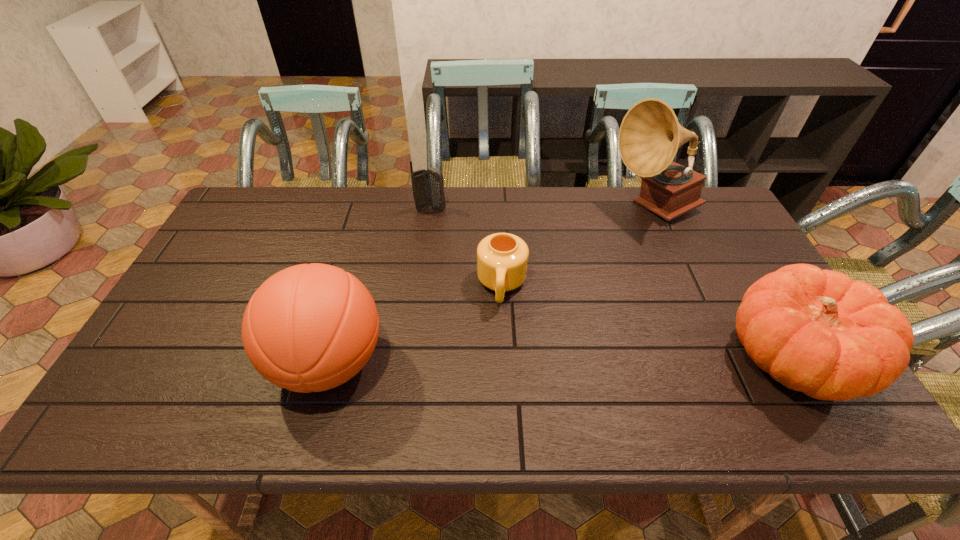
Locate an element on the screen. The height and width of the screenshot is (540, 960). free region at the far left corner is located at coordinates (265, 208).

This screenshot has width=960, height=540. Identify the location of free space between the third object from right to left and the phonograph record. (578, 247).

Locate an element on the screen. vacant point located between the fourth object from right to left and the pumpkin is located at coordinates (611, 284).

You are a GUI agent. You are given a task and a screenshot of the screen. Output one action in this format:
    pyautogui.click(x=<x>, y=<y>)
    Task: Click on the free spot between the cellular telephone and the tallest object
    
    Given the screenshot: What is the action you would take?
    pyautogui.click(x=542, y=209)

Where is `free space between the tallest object and the mug`? The image size is (960, 540). free space between the tallest object and the mug is located at coordinates (578, 247).

The width and height of the screenshot is (960, 540). I want to click on unoccupied position between the fourth object from right to left and the phonograph record, so click(542, 209).

This screenshot has width=960, height=540. Identify the location of vacant area between the shortest object and the cellular telephone. (467, 247).

Find the location of a particular element. The image size is (960, 540). vacant point located between the pumpkin and the second object from left to right is located at coordinates (611, 284).

You are a GUI agent. You are given a task and a screenshot of the screen. Output one action in this format:
    pyautogui.click(x=<x>, y=<y>)
    Task: Click on the free space between the tallest object and the shortest object
    Image resolution: width=960 pixels, height=540 pixels.
    Given the screenshot: What is the action you would take?
    pyautogui.click(x=578, y=247)

Find the location of a particular element. The image size is (960, 540). free space between the pumpkin and the tallest object is located at coordinates (723, 284).